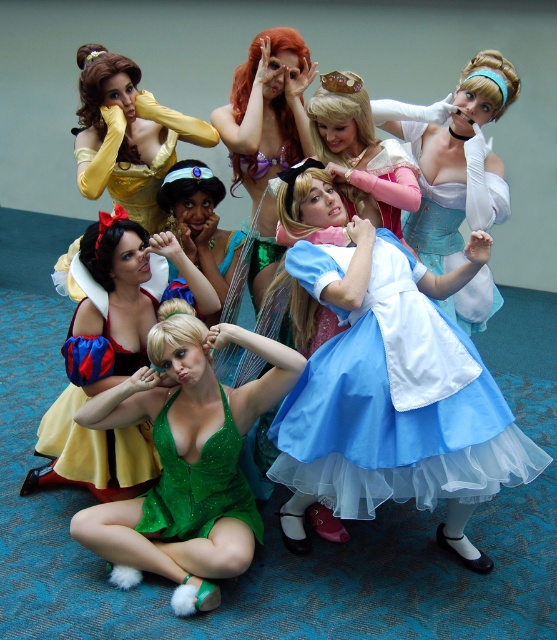
Between green sparkly dress at lower left and shiny purple dress at center, which one appears on the left side from the viewer's perspective?

green sparkly dress at lower left

Is green sparkly dress at lower left to the left of shiny purple dress at center from the viewer's perspective?

Indeed, green sparkly dress at lower left is positioned on the left side of shiny purple dress at center.

Is point (77, 381) closer to camera compared to point (275, 260)?

Yes, point (77, 381) is closer to viewer.

Identify the location of green sparkly dress at lower left. Image resolution: width=557 pixels, height=640 pixels. (110, 358).

At what (x,y) coordinates should I click in order to perform the action: click on green sparkly dress at lower left. Please return your answer as a coordinate pair (x, y). The height and width of the screenshot is (640, 557). Looking at the image, I should click on (110, 358).

Describe the element at coordinates (110, 358) in the screenshot. I see `green sparkly dress at lower left` at that location.

The width and height of the screenshot is (557, 640). Find the location of `green sparkly dress at lower left`. green sparkly dress at lower left is located at coordinates (110, 358).

Does blue satin dress at center have a greater width compared to green sparkly dress at lower left?

Indeed, blue satin dress at center has a greater width compared to green sparkly dress at lower left.

Does blue satin dress at center lie in front of green sparkly dress at lower left?

Yes.

Is point (286, 456) farther from viewer compared to point (116, 280)?

No.

You are a GUI agent. You are given a task and a screenshot of the screen. Output one action in this format:
    pyautogui.click(x=<x>, y=<y>)
    Task: Click on the blue satin dress at center
    
    Given the screenshot: What is the action you would take?
    pyautogui.click(x=387, y=381)